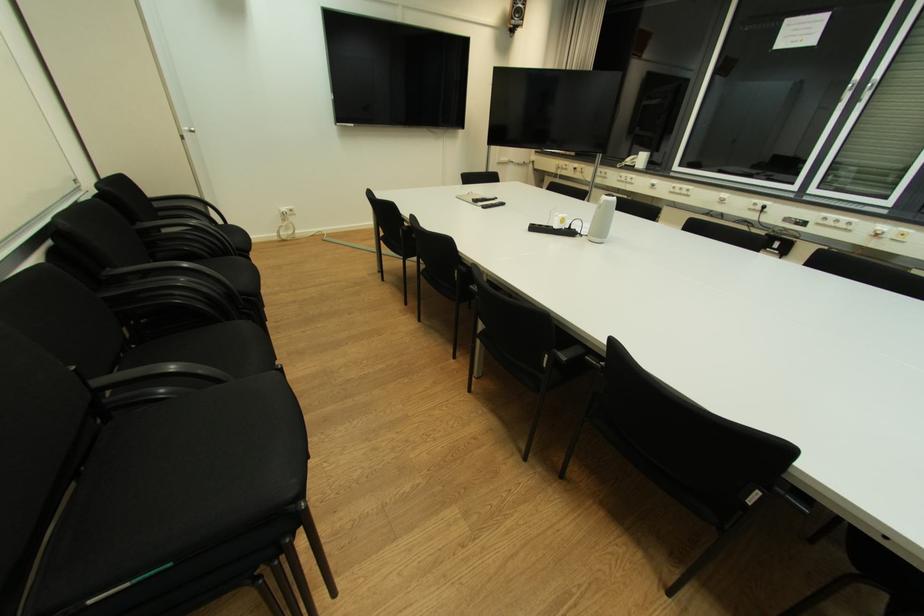
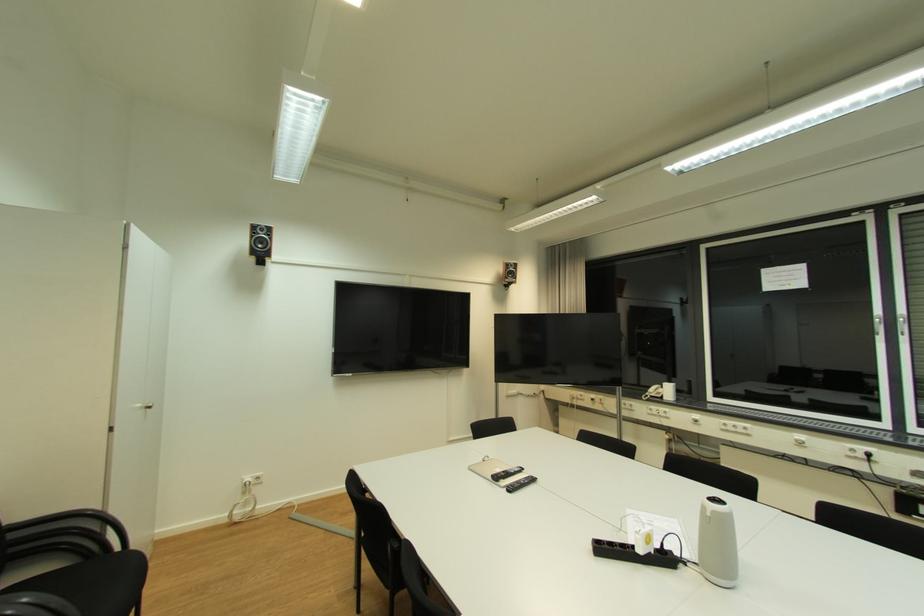
Where in the second image is the point corresponding to (152,196) from the first image?

(11, 525)